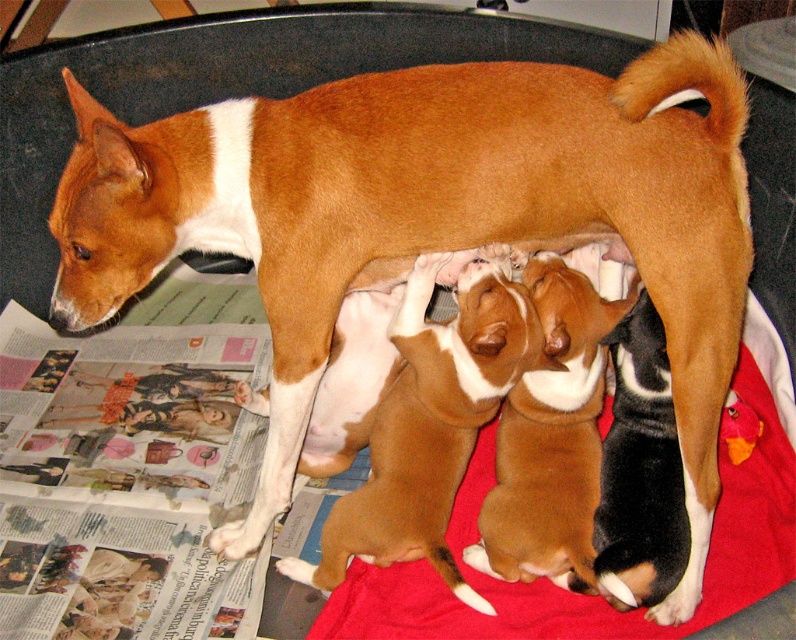
You are a photographer standing 1.5 meters away from the camera position. You want to place a red fabric blanket at center closer to the camera without moving the camera. How much distance do you need to move the blanket forward to make it exactly 0.3 meters away from the camera?

The red fabric blanket at center is currently 1.18 meters from the camera. To move it to 0.3 meters away, you need to move it forward by 0.88 meters.

You are a photographer taking a picture of the mother dog and her puppies. You notice two points marked in the image at coordinates point [599,630] and point [586,547]. To ensure the puppies are centered in the photo, which point should you focus on?

Point [599,630] is in front of point [586,547], so focusing on point [599,630] will help center the puppies since it is closer to the front where the puppies are nursing under the mother dog.